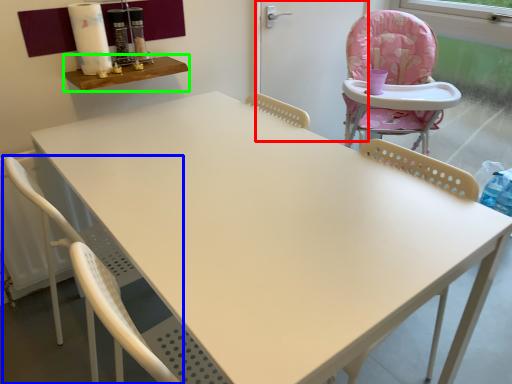
Question: Estimate the real-world distances between objects in this image. Which object is closer to screen door (highlighted by a red box), chair (highlighted by a blue box) or table (highlighted by a green box)?

Choices:
 (A) chair
 (B) table

Answer: (B)